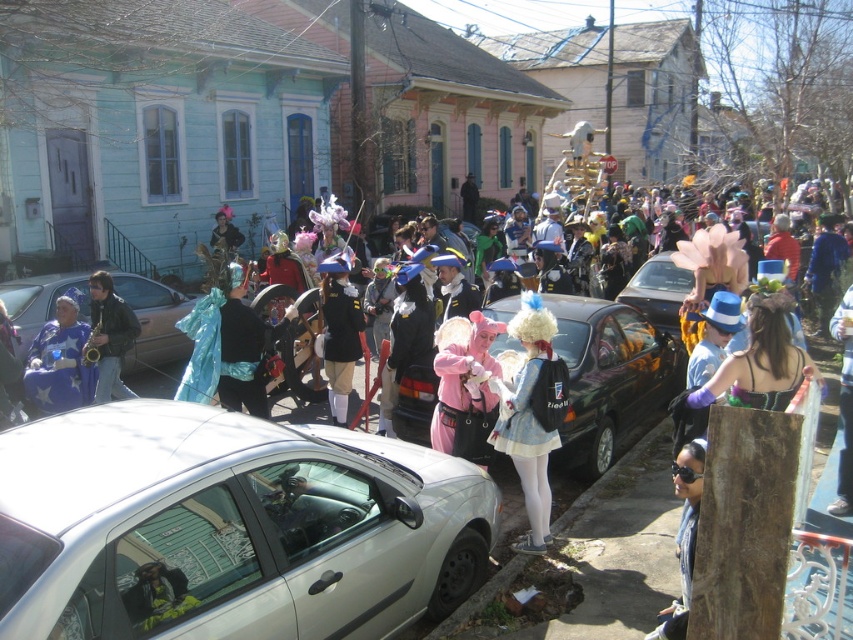
Question: Among these objects, which one is nearest to the camera?

Choices:
 (A) blue shiny fabric at center
 (B) matte blue costume at left
 (C) white matte dress at center

Answer: (C)

Question: Which object is the closest to the blue shiny fabric at center?

Choices:
 (A) metallic silver car at left
 (B) black leather jacket at left

Answer: (B)

Question: Which point is closer to the camera?

Choices:
 (A) silver metallic car at lower left
 (B) matte blue costume at left
 (C) blue shiny fabric at center
 (D) sunglasses at center

Answer: (A)

Question: Is silver metallic car at lower left positioned before shiny black uniform at center?

Choices:
 (A) no
 (B) yes

Answer: (B)

Question: Considering the relative positions of matte blue costume at left and black leather jacket at left in the image provided, where is matte blue costume at left located with respect to black leather jacket at left?

Choices:
 (A) above
 (B) below

Answer: (B)

Question: Is shiny black uniform at center wider than sunglasses at center?

Choices:
 (A) yes
 (B) no

Answer: (A)